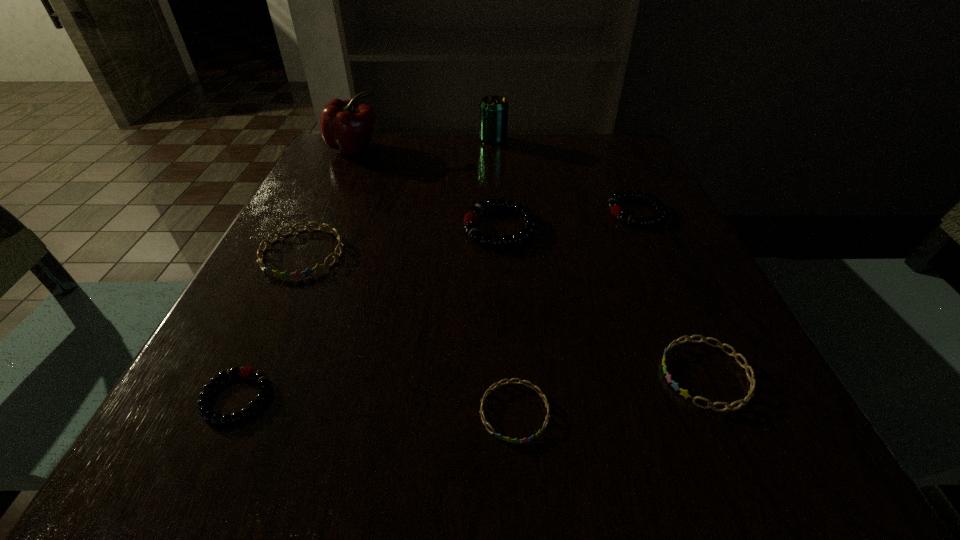
In order to click on blue bracelet that can be found as the closest to the second black bracelet from left to right in this screenshot , I will do `click(307, 272)`.

Where is `free space that satisfies the following two spatial constraints: 1. on the back side of the second smallest black bracelet; 2. on the left side of the biggest black bracelet`? This screenshot has width=960, height=540. free space that satisfies the following two spatial constraints: 1. on the back side of the second smallest black bracelet; 2. on the left side of the biggest black bracelet is located at coordinates (499, 212).

Locate an element on the screen. free space that satisfies the following two spatial constraints: 1. on the surface of the second smallest blue bracelet showing star-shaped elements; 2. on the surface of the smallest blue bracelet showing star-shaped elements is located at coordinates (723, 411).